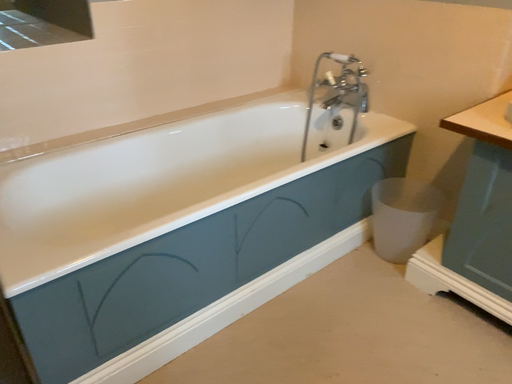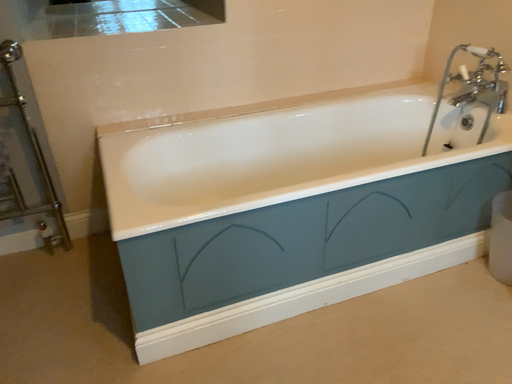
Question: Which way did the camera rotate in the video?

Choices:
 (A) rotated right
 (B) rotated left

Answer: (B)